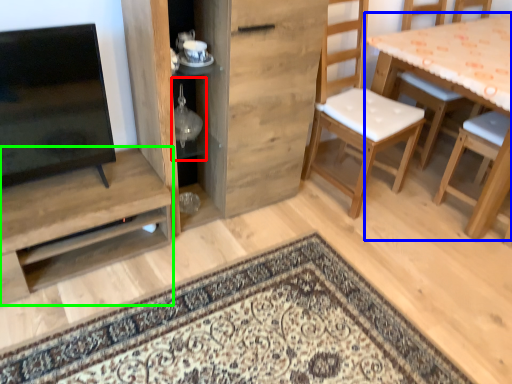
Question: Which object is positioned farthest from shelf (highlighted by a red box)? Select from table (highlighted by a blue box) and shelf (highlighted by a green box).

Choices:
 (A) table
 (B) shelf

Answer: (A)